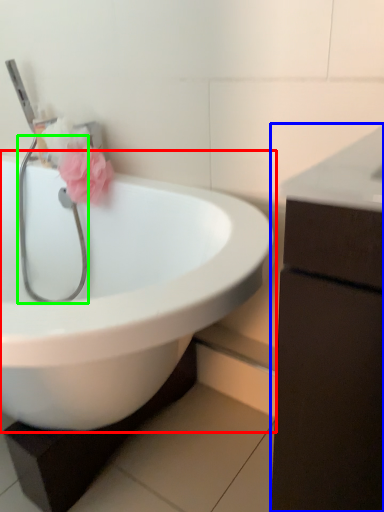
Question: Which object is positioned farthest from sink (highlighted by a red box)? Select from bathroom cabinet (highlighted by a blue box) and stethoscope (highlighted by a green box).

Choices:
 (A) bathroom cabinet
 (B) stethoscope

Answer: (A)